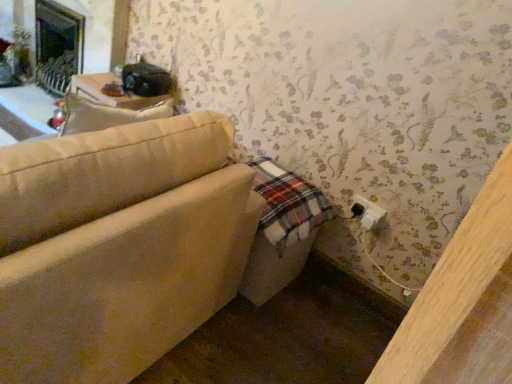
Question: Can you confirm if white plastic electric outlet at lower right is smaller than beige fabric couch at lower left?

Choices:
 (A) no
 (B) yes

Answer: (B)

Question: From the image's perspective, is white plastic electric outlet at lower right on beige fabric couch at lower left?

Choices:
 (A) yes
 (B) no

Answer: (B)

Question: From the image's perspective, does white plastic electric outlet at lower right appear lower than beige fabric couch at lower left?

Choices:
 (A) no
 (B) yes

Answer: (B)

Question: Is white plastic electric outlet at lower right oriented towards beige fabric couch at lower left?

Choices:
 (A) no
 (B) yes

Answer: (A)

Question: Does white plastic electric outlet at lower right have a lesser width compared to beige fabric couch at lower left?

Choices:
 (A) no
 (B) yes

Answer: (B)

Question: Considering the relative positions of white plastic electric outlet at lower right and beige fabric couch at lower left in the image provided, is white plastic electric outlet at lower right to the right of beige fabric couch at lower left from the viewer's perspective?

Choices:
 (A) no
 (B) yes

Answer: (B)

Question: Can you confirm if beige fabric couch at lower left is smaller than white plastic electric outlet at lower right?

Choices:
 (A) no
 (B) yes

Answer: (A)

Question: Is beige fabric couch at lower left facing towards white plastic electric outlet at lower right?

Choices:
 (A) no
 (B) yes

Answer: (A)

Question: Does beige fabric couch at lower left lie behind white plastic electric outlet at lower right?

Choices:
 (A) yes
 (B) no

Answer: (B)

Question: Would you consider beige fabric couch at lower left to be distant from white plastic electric outlet at lower right?

Choices:
 (A) no
 (B) yes

Answer: (B)

Question: From the image's perspective, is beige fabric couch at lower left located above white plastic electric outlet at lower right?

Choices:
 (A) yes
 (B) no

Answer: (A)

Question: Can you confirm if beige fabric couch at lower left is wider than white plastic electric outlet at lower right?

Choices:
 (A) no
 (B) yes

Answer: (B)

Question: Visually, is beige fabric couch at lower left positioned to the left or to the right of white plastic electric outlet at lower right?

Choices:
 (A) right
 (B) left

Answer: (B)